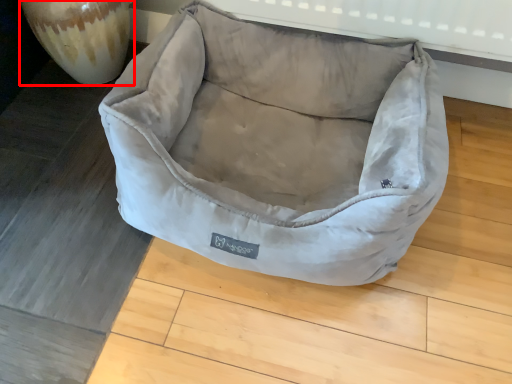
Question: From the image's perspective, where is glass vase (annotated by the red box) located in relation to dog bed in the image?

Choices:
 (A) above
 (B) below

Answer: (A)